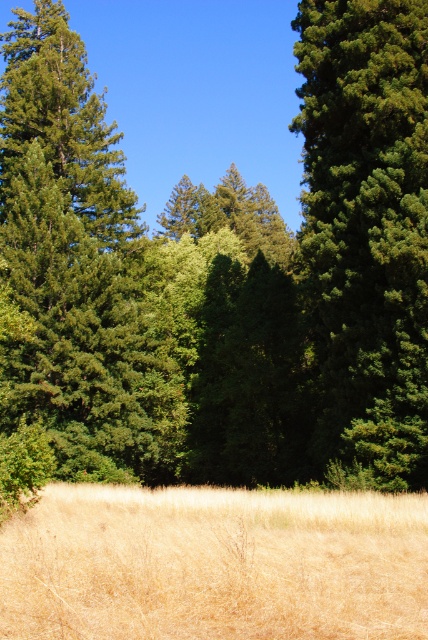
Identify the location of dry grass at center. (214, 564).

Does dry grass at center have a lesser height compared to green matte tree at right?

Correct, dry grass at center is not as tall as green matte tree at right.

The width and height of the screenshot is (428, 640). In order to click on dry grass at center in this screenshot , I will do `click(214, 564)`.